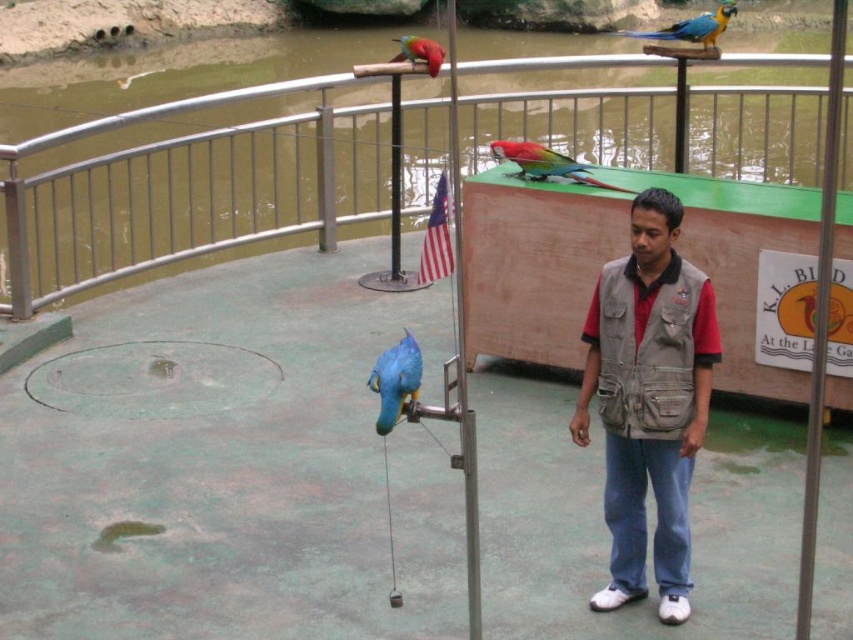
Does blue glossy parrot at upper center have a lesser height compared to shiny red parrot at upper center?

No.

Which is in front, point (728, 16) or point (410, 38)?

Point (728, 16) is more forward.

Between point (733, 13) and point (413, 54), which one is positioned in front?

Point (413, 54)

The height and width of the screenshot is (640, 853). In order to click on blue glossy parrot at upper center in this screenshot , I will do coord(692,26).

Who is positioned more to the left, blue glossy parrot at center or shiny red parrot at upper center?

From the viewer's perspective, shiny red parrot at upper center appears more on the left side.

Measure the distance between blue glossy parrot at center and camera.

The distance of blue glossy parrot at center from camera is 4.45 meters.

The height and width of the screenshot is (640, 853). Find the location of `blue glossy parrot at center`. blue glossy parrot at center is located at coordinates (395, 380).

The image size is (853, 640). What do you see at coordinates (544, 163) in the screenshot? I see `green matte parrot at center` at bounding box center [544, 163].

Does green matte parrot at center lie in front of blue glossy parrot at upper center?

Yes, green matte parrot at center is in front of blue glossy parrot at upper center.

Who is more distant from viewer, (578, 179) or (695, 40)?

The point (695, 40) is more distant.

In order to click on green matte parrot at center in this screenshot , I will do `click(544, 163)`.